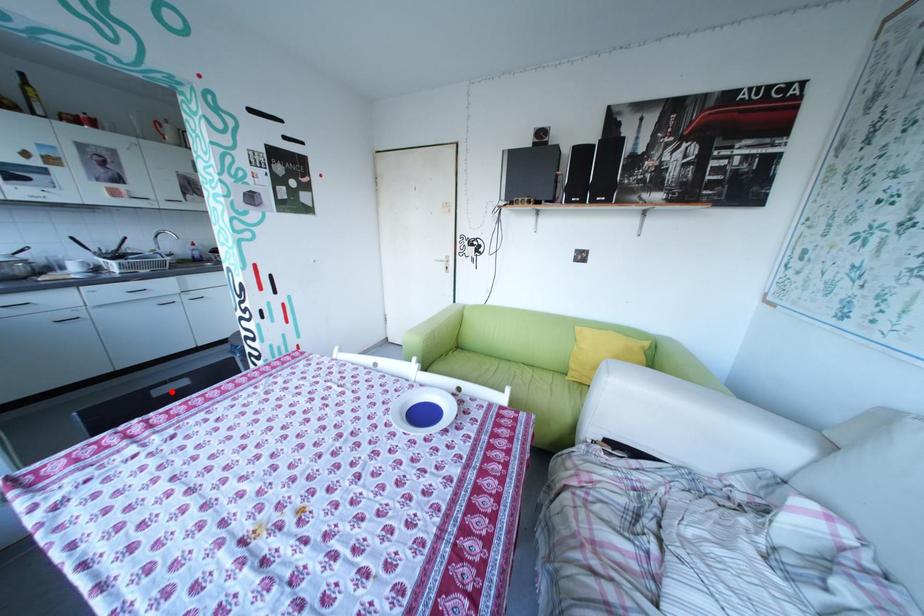
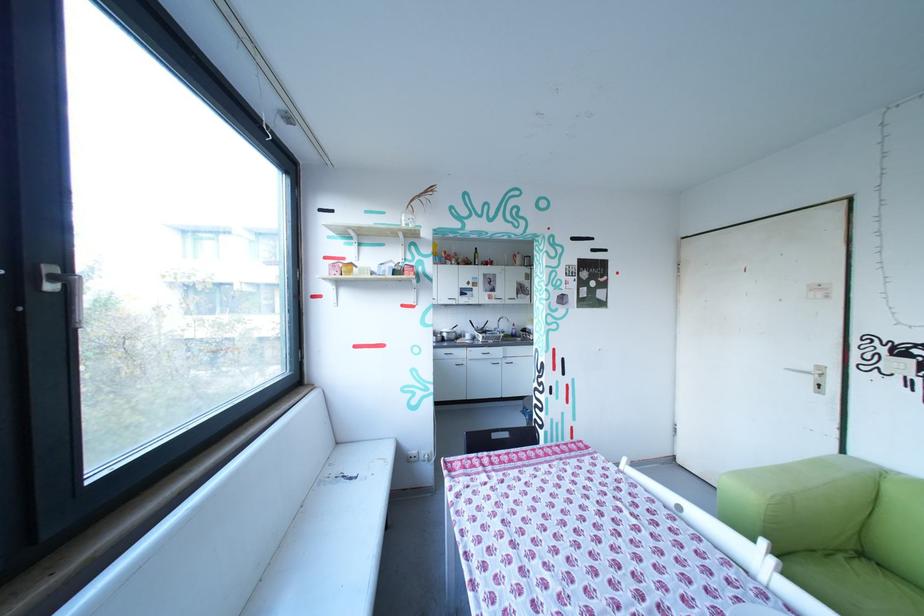
Question: I am providing you with two images of the same scene from different viewpoints. In image1, a red point is highlighted. Considering the same 3D point in image2, which of the following is correct?

Choices:
 (A) It is closer
 (B) It is farther

Answer: (A)